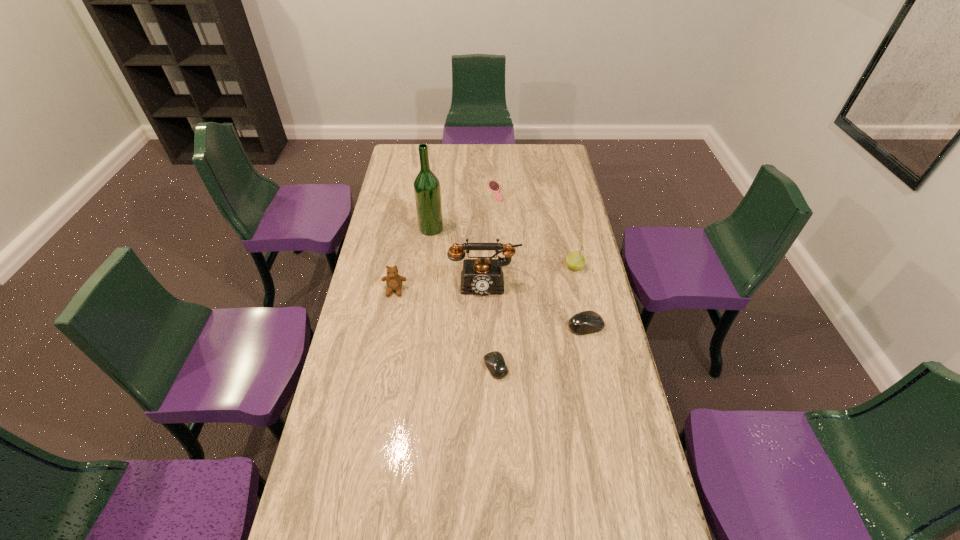
With all mouses evenly spaced, where should an extra mouse be placed on the left to continue the pattern? Please point out a vacant space. Please provide its 2D coordinates. Your answer should be formatted as a tuple, i.e. [(x, y)], where the tuple contains the x and y coordinates of a point satisfying the conditions above.

[(391, 414)]